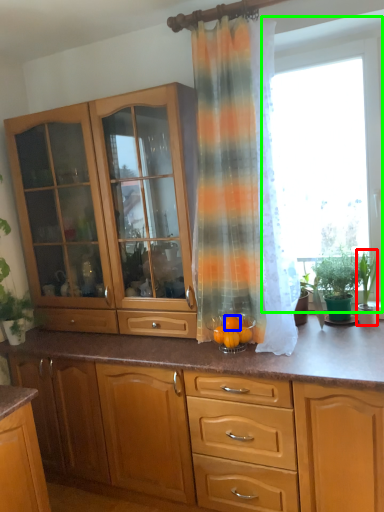
Question: Which object is the farthest from houseplant (highlighted by a red box)? Choose among these: orange (highlighted by a blue box) or window screen (highlighted by a green box).

Choices:
 (A) orange
 (B) window screen

Answer: (A)